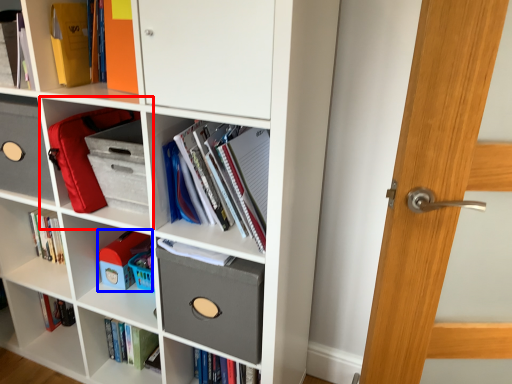
Question: Which of the following is the farthest to the observer, shelf (highlighted by a red box) or toy (highlighted by a blue box)?

Choices:
 (A) shelf
 (B) toy

Answer: (B)